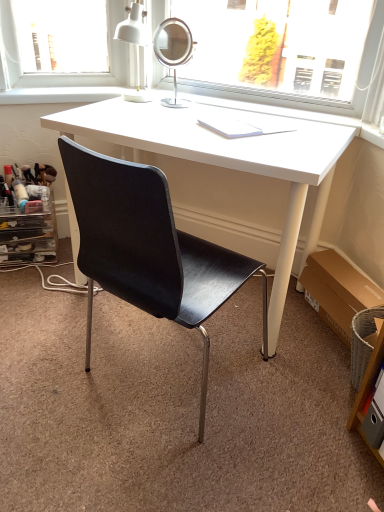
Locate an element on the screen. blank space situated above white glossy desk at center (from a real-world perspective) is located at coordinates (220, 124).